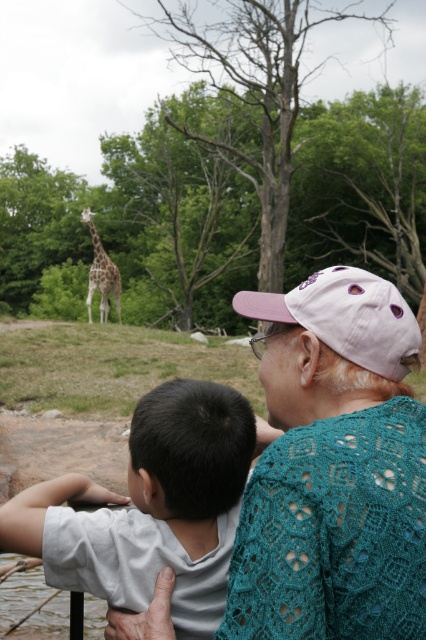
You are a photographer trying to capture a photo of the giraffe in the background. You notice the white matte shirt at upper left and the pink fabric baseball cap at center are blocking your view. Which object should you move to get a clearer view of the giraffe?

The white matte shirt at upper left is taller than the pink fabric baseball cap at center, so you should move the white matte shirt at upper left to get a clearer view of the giraffe.

You are a photographer trying to capture a photo of the spotted fur giraffe at upper left. There is a person wearing a white matte shirt at upper left blocking your view. To get a clear shot of the giraffe, should you move to the left or right of the person?

Since the white matte shirt at upper left is to the right of the spotted fur giraffe at upper left, you should move to the left of the person to get a clear shot of the giraffe.

What object is located at the coordinates point (345, 316)?

The point (345, 316) marks the pink fabric baseball cap at center.